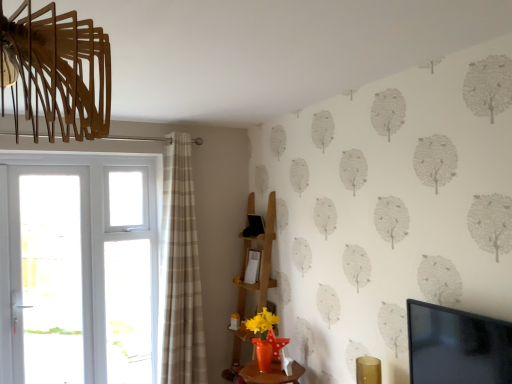
Question: Considering the positions of white glass screen door at left and beige plaid curtain at left in the image, is white glass screen door at left taller or shorter than beige plaid curtain at left?

Choices:
 (A) tall
 (B) short

Answer: (B)

Question: Is white glass screen door at left wider or thinner than beige plaid curtain at left?

Choices:
 (A) thin
 (B) wide

Answer: (A)

Question: Which of these objects is positioned farthest from the white plastic door at left?

Choices:
 (A) wooden shelf at center
 (B) white glass screen door at left
 (C) black glossy tv at upper right
 (D) beige plaid curtain at left

Answer: (C)

Question: Estimate the real-world distances between objects in this image. Which object is farther from the wooden shelf at center?

Choices:
 (A) white plastic door at left
 (B) white glass screen door at left
 (C) beige plaid curtain at left
 (D) black glossy tv at upper right

Answer: (D)